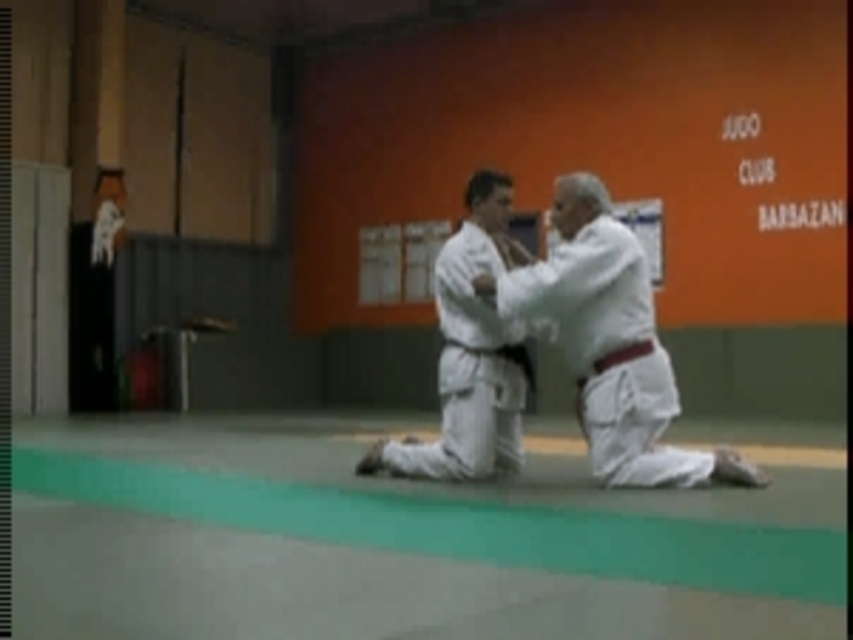
Looking at this image, you are a judo student standing at the entrance of the dojo. You want to approach the white cloth kimono at center to adjust its position. Which direction should you walk to reach it?

The white cloth kimono at center is located at point 0.534 on the x axis and 0.715 on the y axis. Since you are at the entrance, you should walk towards the center of the room to reach it.